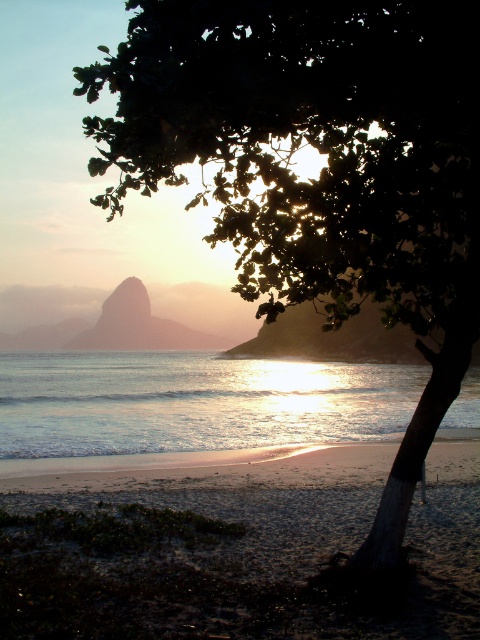
You are standing on the sandy beach at lower left and want to reach the shiny metallic water at center. Which direction should you walk to get there?

You should walk towards the center from the sandy beach at lower left to reach the shiny metallic water at center because the sandy beach at lower left is shorter than shiny metallic water at center.